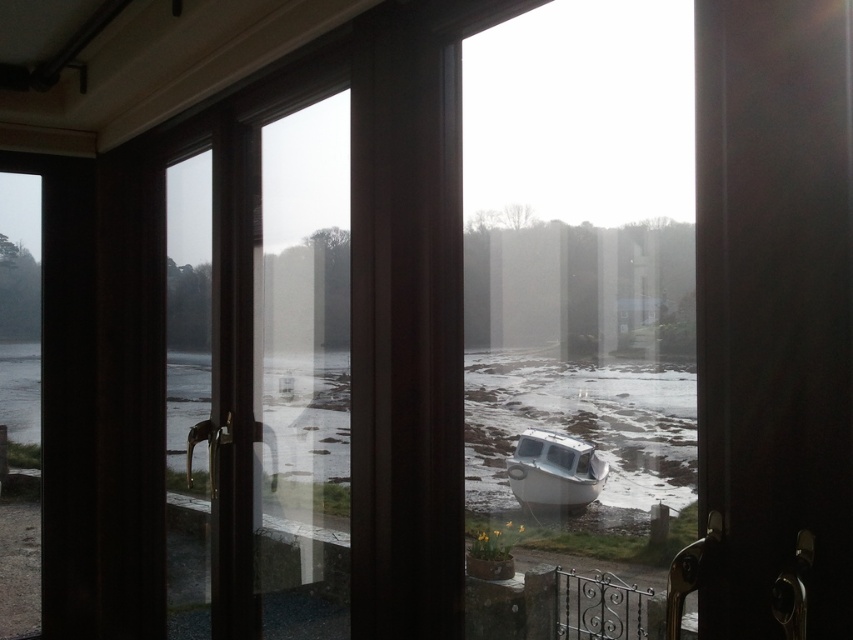
Who is more distant from viewer, (x=506, y=358) or (x=550, y=476)?

The point (x=506, y=358) is more distant.

Does clear water at lower center appear over white matte boat at center?

Incorrect, clear water at lower center is not positioned above white matte boat at center.

Who is more forward, (x=625, y=432) or (x=605, y=460)?

Positioned in front is point (x=625, y=432).

At what (x,y) coordinates should I click in order to perform the action: click on clear water at lower center. Please return your answer as a coordinate pair (x, y). This screenshot has height=640, width=853. Looking at the image, I should click on (577, 433).

Measure the distance between point (x=764, y=384) and camera.

They are 1.13 meters apart.

Does dark wood screen door at center appear over clear water at lower center?

Correct, dark wood screen door at center is located above clear water at lower center.

What do you see at coordinates (775, 305) in the screenshot?
I see `dark wood screen door at center` at bounding box center [775, 305].

Locate an element on the screen. dark wood screen door at center is located at coordinates click(x=775, y=305).

Does dark wood screen door at center have a lesser height compared to white matte boat at center?

No.

Does dark wood screen door at center have a lesser width compared to white matte boat at center?

Yes, dark wood screen door at center is thinner than white matte boat at center.

Which is in front, point (828, 221) or point (555, 440)?

Point (828, 221) is in front.

Locate an element on the screen. This screenshot has width=853, height=640. dark wood screen door at center is located at coordinates (775, 305).